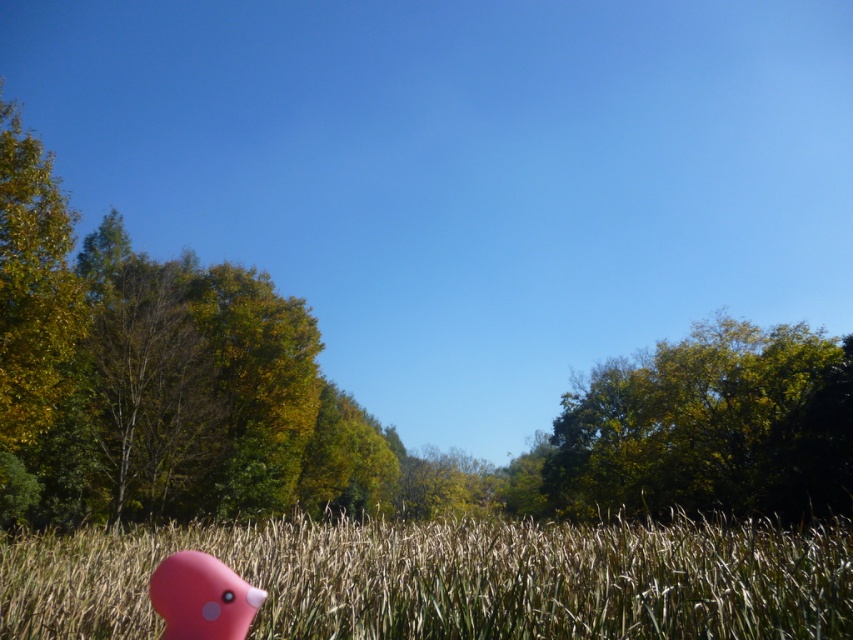
Consider the image. You are standing in the field of tall dry grass and see the green leafy tree at upper right and the pink rubber duck at lower left. Which object is positioned to the right side of the other?

The green leafy tree at upper right is positioned to the right of the pink rubber duck at lower left.

You are standing at the edge of the grassy field at lower center and see the pink rubber duck at lower left. If you want to walk directly to the duck, will you need to walk across the field?

The grassy field at lower center might be wider than pink rubber duck at lower left, so it is possible that you would need to walk across the field to reach the duck. However, the exact distance isn

You are standing in the middle of the grassy field at lower center and want to reach the green leafy tree at upper right. Which direction should you walk to get closer to the tree?

You should walk towards the upper right direction to get closer to the green leafy tree at upper right since it is located in that direction.